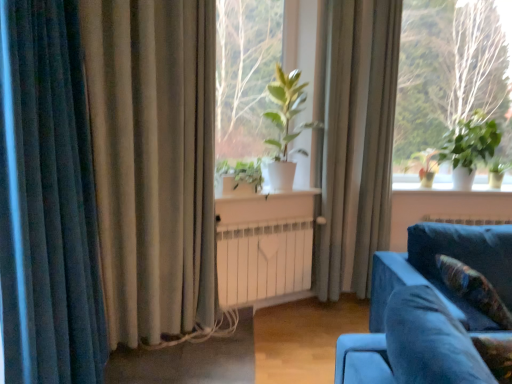
You are a GUI agent. You are given a task and a screenshot of the screen. Output one action in this format:
    pyautogui.click(x=<x>, y=<y>)
    Task: Click on the vacant space underneath white matte radiator at center (from a real-world perspective)
    
    Given the screenshot: What is the action you would take?
    pyautogui.click(x=271, y=317)